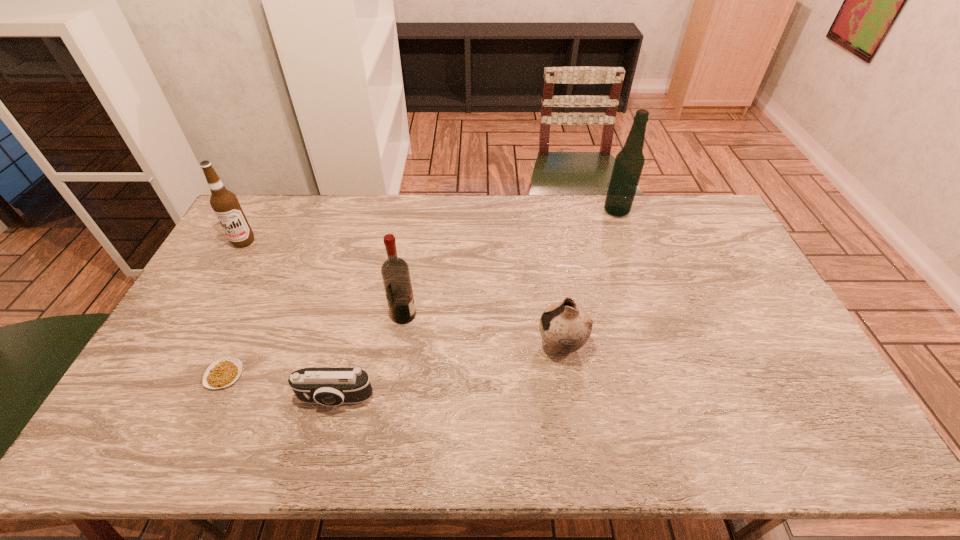
Identify the location of the shortest object. This screenshot has height=540, width=960. (223, 372).

Where is `the fifth object from right to left`? the fifth object from right to left is located at coordinates pos(223,372).

Image resolution: width=960 pixels, height=540 pixels. What are the coordinates of `free space located 0.400m on the left of the rightmost object` in the screenshot? It's located at (498, 211).

Identify the location of free spot located 0.160m on the label of the leftmost object. This screenshot has height=540, width=960. (221, 283).

Where is `free region located on the front and back of the third object from right to left`? The width and height of the screenshot is (960, 540). free region located on the front and back of the third object from right to left is located at coordinates (446, 315).

Locate an element on the screen. The height and width of the screenshot is (540, 960). vacant point located from the spout of the fourth tallest object is located at coordinates (455, 345).

Image resolution: width=960 pixels, height=540 pixels. Find the location of `free region located from the spout of the fourth tallest object`. free region located from the spout of the fourth tallest object is located at coordinates point(463,345).

Locate an element on the screen. vacant area situated 0.200m from the spout of the fourth tallest object is located at coordinates (466, 345).

This screenshot has height=540, width=960. What are the coordinates of `vacant space located 0.360m on the back of the fifth object from right to left` in the screenshot? It's located at (274, 267).

Identify the location of alcohol located at the left edge. [225, 204].